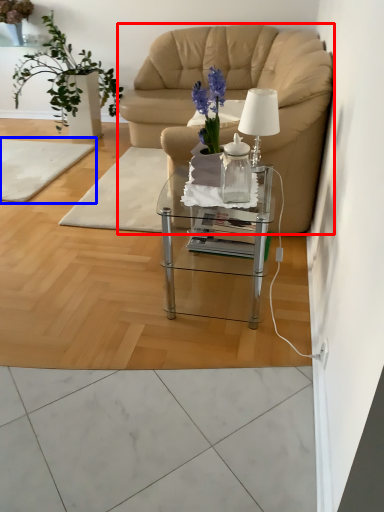
Question: Among these objects, which one is nearest to the camera, chair (highlighted by a red box) or mat (highlighted by a blue box)?

Choices:
 (A) chair
 (B) mat

Answer: (A)